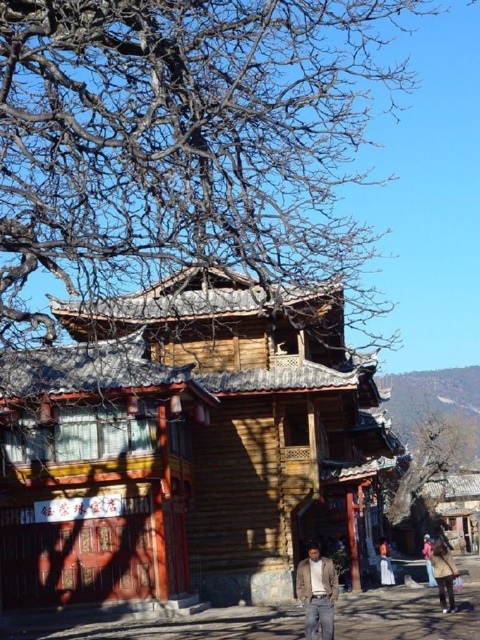
You are a visitor standing at the entrance of the traditional wooden building. You notice two fabrics, an orange fabric at lower right and a pink fabric at lower right. How far apart are these two fabrics from each other?

The orange fabric at lower right is 7.40 feet from the pink fabric at lower right.